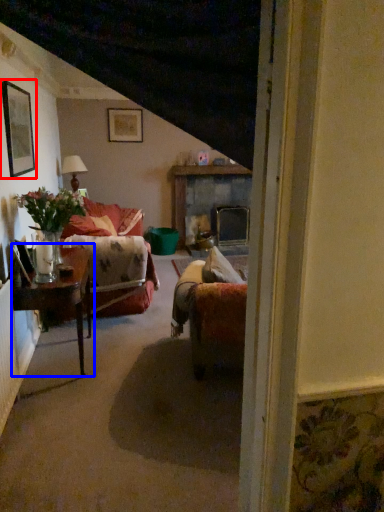
Question: Which object is closer to the camera taking this photo, picture frame (highlighted by a red box) or table (highlighted by a blue box)?

Choices:
 (A) picture frame
 (B) table

Answer: (B)